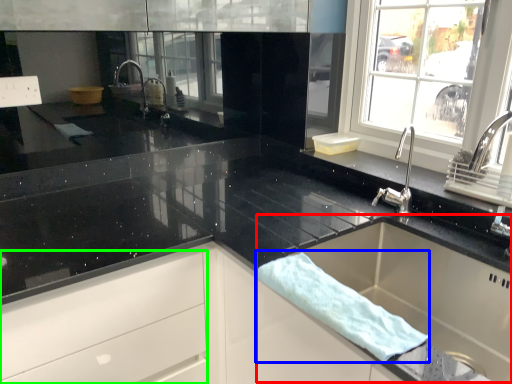
Question: Considering the real-world distances, which object is farthest from sink (highlighted by a red box)? bath towel (highlighted by a blue box) or drawer (highlighted by a green box)?

Choices:
 (A) bath towel
 (B) drawer

Answer: (B)